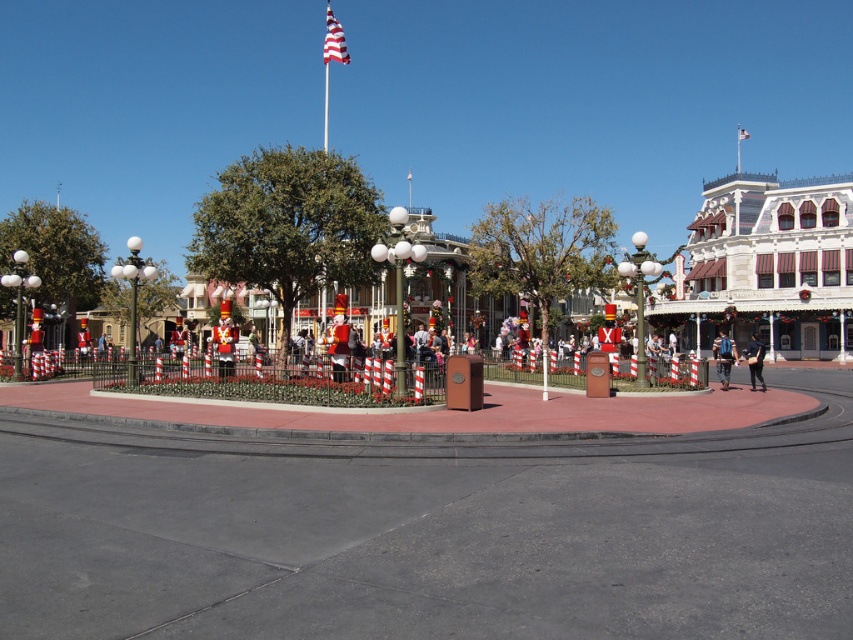
You are standing on the sidewalk and see the american flag at upper center and the black leather jacket at center. Which object is higher in the image?

The american flag at upper center is higher in the image because it is located above the black leather jacket at center.

You are standing at the entrance of the plaza and see the american flag at upper center and the black leather jacket at center. Which object is taller?

The american flag at upper center is taller than the black leather jacket at center.

You are a photographer wanting to capture both the american flag at upper center and the black leather jacket at center in a single shot. Based on their sizes in the image, which object would appear bigger in your photo?

The american flag at upper center would appear bigger in the photo because it has a larger size compared to the black leather jacket at center.